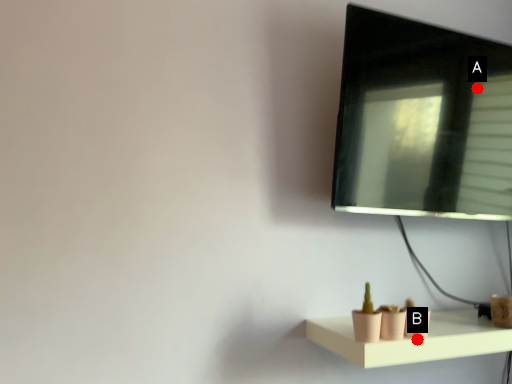
Question: Two points are circled on the image, labeled by A and B beside each circle. Which point is closer to the camera?

Choices:
 (A) A is closer
 (B) B is closer

Answer: (B)